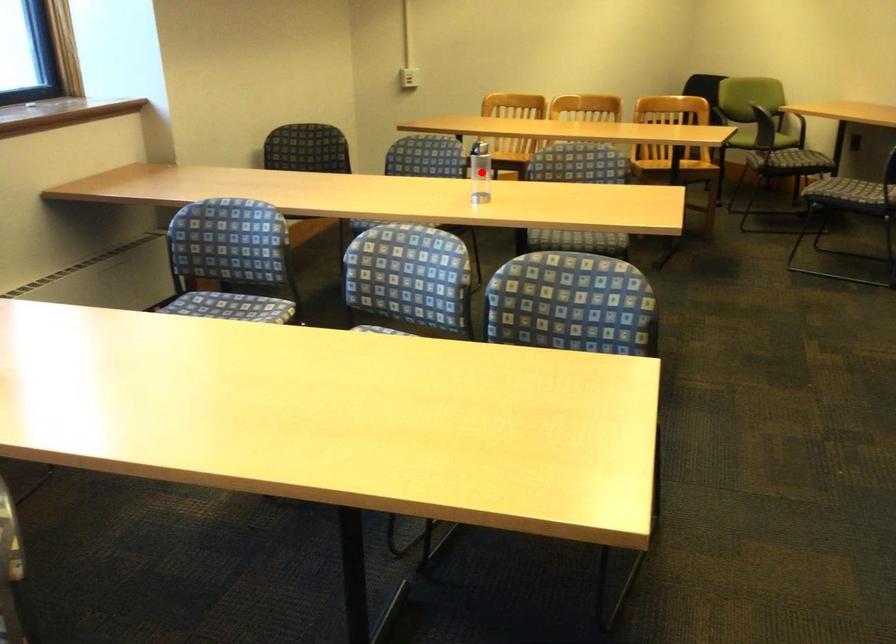
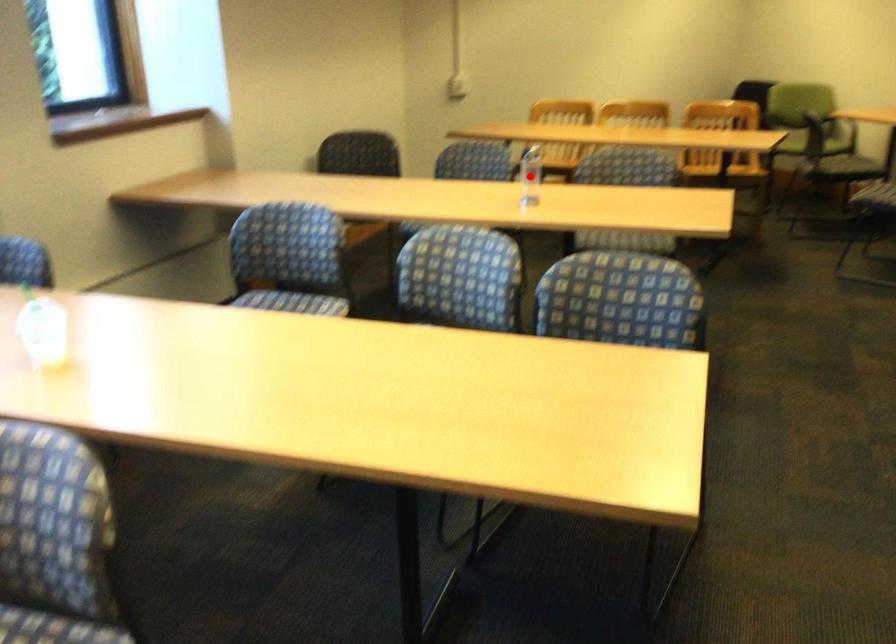
I am providing you with two images of the same scene from different viewpoints. A red point is marked on the first image and another point is marked on the second image. Is the red point in image1 aligned with the point shown in image2?

Yes